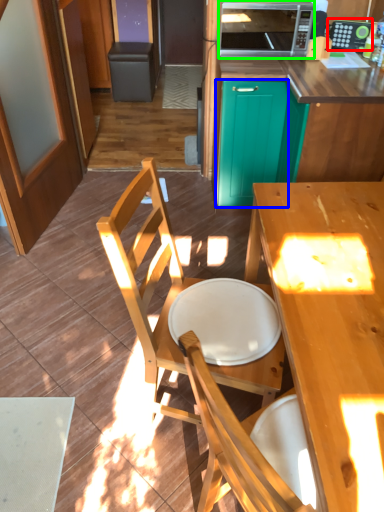
Question: Which is farther away from appliance (highlighted by a red box)? screen door (highlighted by a blue box) or microwave oven (highlighted by a green box)?

Choices:
 (A) screen door
 (B) microwave oven

Answer: (A)